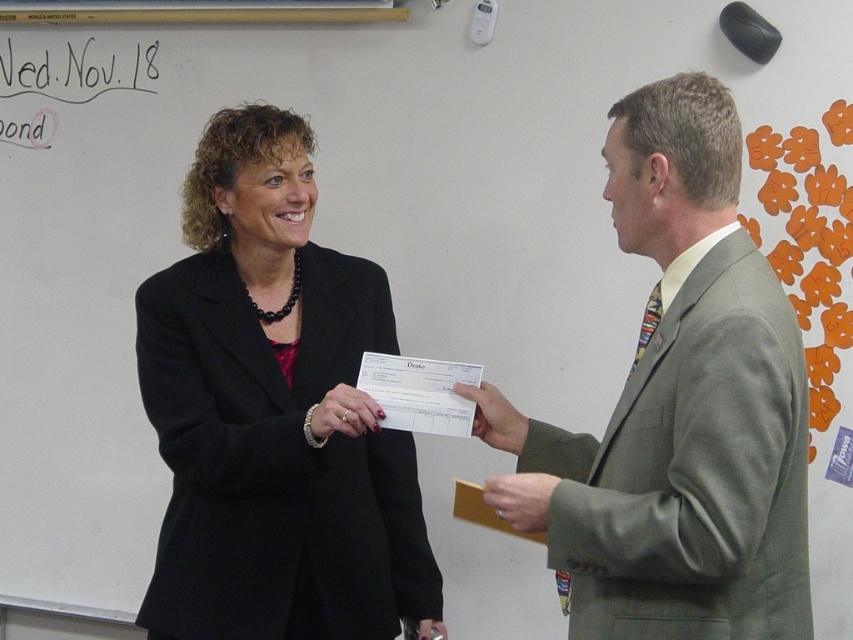
From the picture: Does black matte blazer at center appear under light gray suit at center?

Indeed, black matte blazer at center is positioned under light gray suit at center.

Which is below, black matte blazer at center or light gray suit at center?

black matte blazer at center is lower down.

Find the location of a particular element. black matte blazer at center is located at coordinates (271, 413).

Locate an element on the screen. Image resolution: width=853 pixels, height=640 pixels. black matte blazer at center is located at coordinates (271, 413).

Can you confirm if black matte blazer at center is bigger than matte black check at center?

Correct, black matte blazer at center is larger in size than matte black check at center.

Which of these two, black matte blazer at center or matte black check at center, stands taller?

black matte blazer at center

Where is `black matte blazer at center`? This screenshot has height=640, width=853. black matte blazer at center is located at coordinates (x=271, y=413).

Can you confirm if light gray suit at center is bigger than matte gray suit at right?

Indeed, light gray suit at center has a larger size compared to matte gray suit at right.

Is light gray suit at center to the left of matte gray suit at right from the viewer's perspective?

Incorrect, light gray suit at center is not on the left side of matte gray suit at right.

Who is more distant from viewer, (561, 504) or (525, 499)?

The point (525, 499) is behind.

At what (x,y) coordinates should I click in order to perform the action: click on light gray suit at center. Please return your answer as a coordinate pair (x, y). The image size is (853, 640). Looking at the image, I should click on (688, 404).